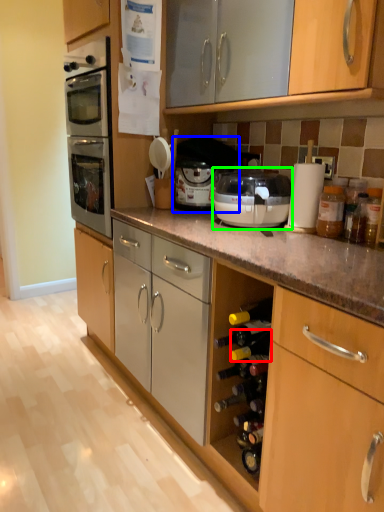
Question: Based on their relative distances, which object is nearer to wine bottle (highlighted by a red box)? Choose from appliance (highlighted by a blue box) and kitchen appliance (highlighted by a green box).

Choices:
 (A) appliance
 (B) kitchen appliance

Answer: (B)